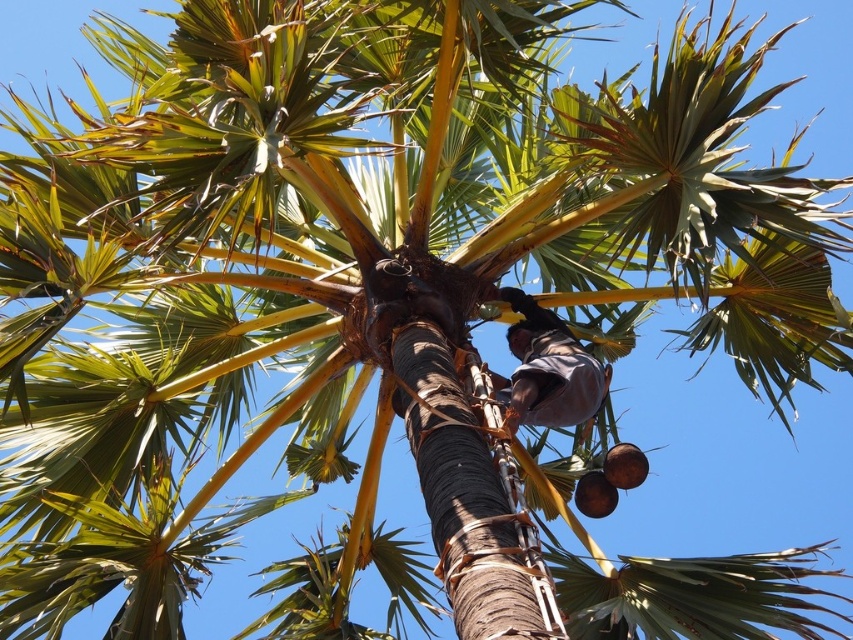
Does brown rough coconut at lower right appear on the left side of brown matte coconut at lower right?

Incorrect, brown rough coconut at lower right is not on the left side of brown matte coconut at lower right.

Does brown rough coconut at lower right have a larger size compared to brown matte coconut at lower right?

Correct, brown rough coconut at lower right is larger in size than brown matte coconut at lower right.

The image size is (853, 640). What are the coordinates of `brown rough coconut at lower right` in the screenshot? It's located at (624, 465).

I want to click on brown rough coconut at lower right, so click(624, 465).

Does brown fabric at center appear on the right side of brown rough coconut at lower right?

In fact, brown fabric at center is to the left of brown rough coconut at lower right.

Can you confirm if brown fabric at center is thinner than brown rough coconut at lower right?

No.

The image size is (853, 640). I want to click on brown fabric at center, so click(x=547, y=371).

Is brown fabric at center wider than brown matte coconut at lower right?

Indeed, brown fabric at center has a greater width compared to brown matte coconut at lower right.

Which of these two, brown fabric at center or brown matte coconut at lower right, stands taller?

Standing taller between the two is brown fabric at center.

Between point (566, 403) and point (595, 472), which one is positioned behind?

The point (595, 472) is behind.

The width and height of the screenshot is (853, 640). What are the coordinates of `brown fabric at center` in the screenshot? It's located at (547, 371).